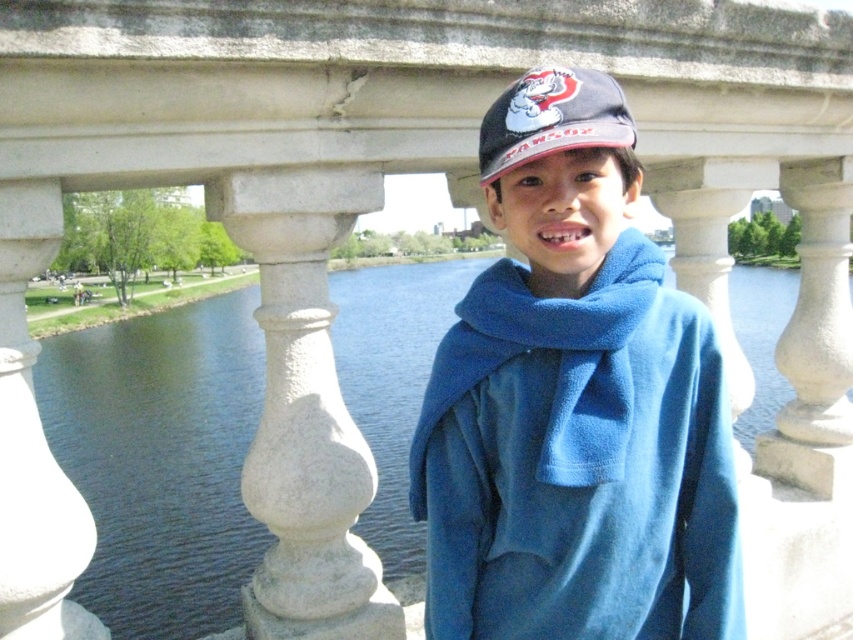
You are a fashion designer observing the young boy in the scene. You need to determine if the blue fleece jacket at center can be paired with the blue fleece scarf at center in a new winter collection. Based on their sizes, is this pairing feasible?

The blue fleece jacket at center is much taller than the blue fleece scarf at center, so pairing them in a winter collection is feasible as the jacket provides a good length contrast to the scarf.

The boy is wearing a blue fleece scarf at center and a matte black cap at center. Which item is located to the left when viewed from the front?

The blue fleece scarf at center is positioned to the left of the matte black cap at center.